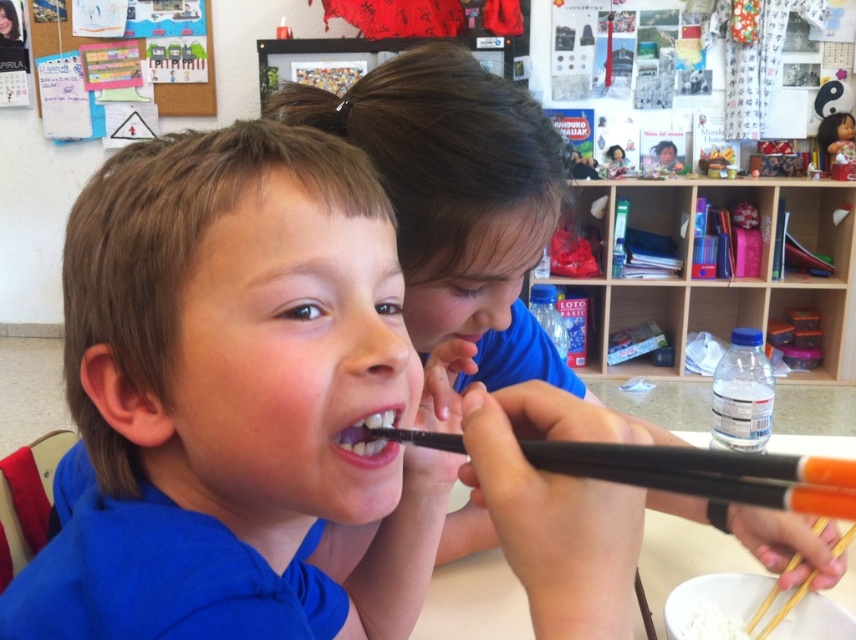
Question: Does wooden chopsticks at lower right have a greater width compared to white matte rice at lower center?

Choices:
 (A) no
 (B) yes

Answer: (B)

Question: Can you confirm if white glossy teeth at center is positioned to the right of white matte rice at lower center?

Choices:
 (A) yes
 (B) no

Answer: (B)

Question: Does black plastic chopstick at mouth have a lesser width compared to pink glossy lips at center?

Choices:
 (A) yes
 (B) no

Answer: (B)

Question: Which object is closer to the camera taking this photo?

Choices:
 (A) blue matte shirt at center
 (B) multicolored paper at upper left
 (C) black plastic chopstick at mouth
 (D) white glossy teeth at center

Answer: (C)

Question: Which point appears closest to the camera in this image?

Choices:
 (A) (744, 636)
 (B) (476, 339)
 (C) (801, 474)

Answer: (C)

Question: Which of the following is the closest to the observer?

Choices:
 (A) wooden chopsticks at lower right
 (B) black plastic chopstick at mouth

Answer: (B)